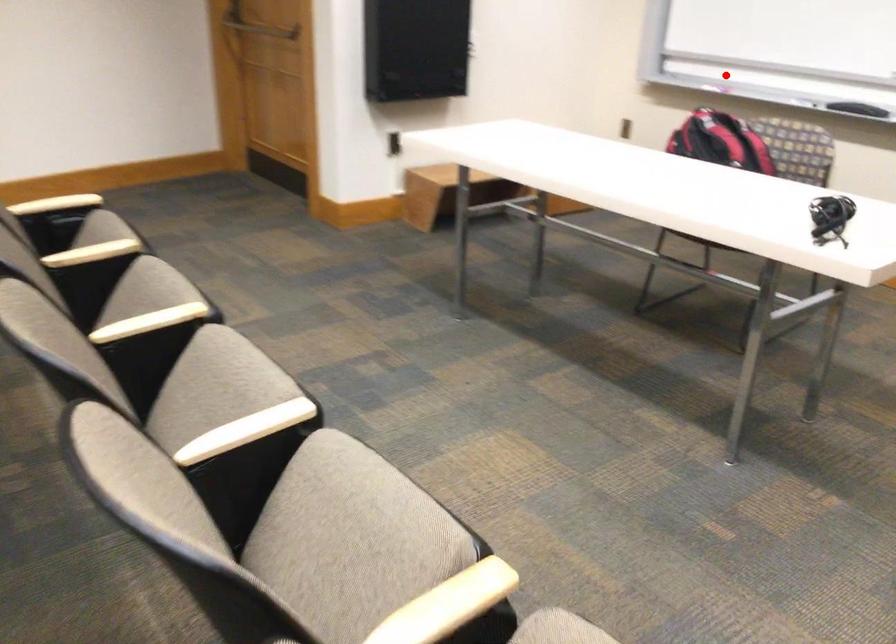
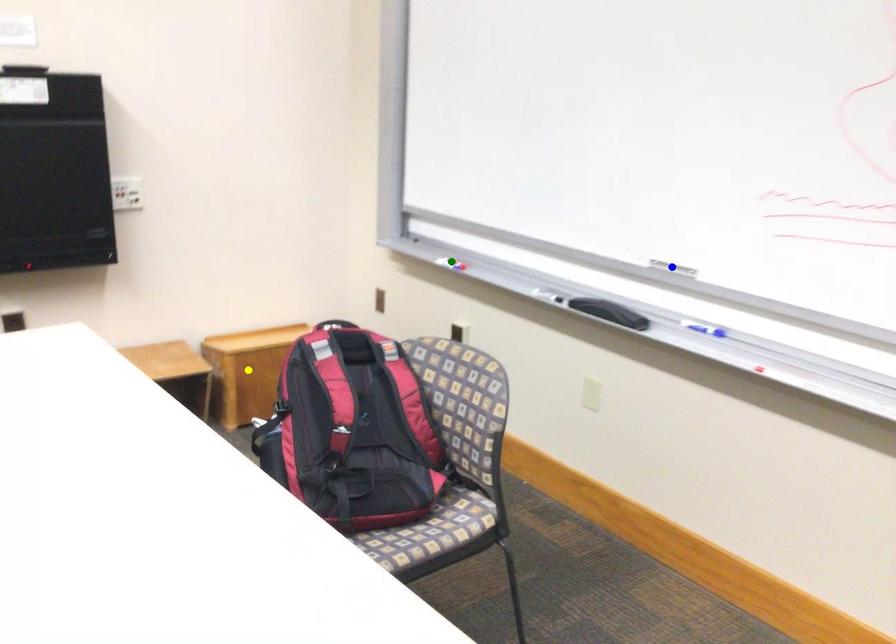
Question: I am providing you with two images of the same scene from different viewpoints. A red point is marked on the first image. You are given multiple points on the second image. Which mark in image 2 goes with the point in image 1?

Choices:
 (A) blue point
 (B) green point
 (C) yellow point

Answer: (B)